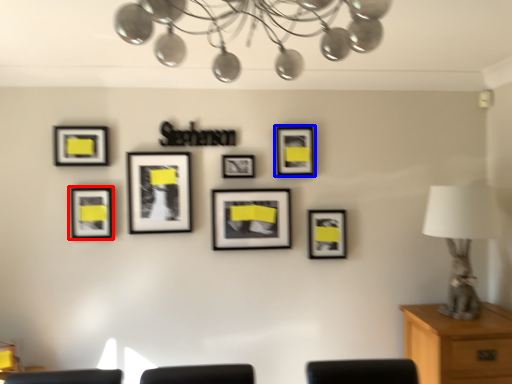
Question: Which object appears closest to the camera in this image, picture frame (highlighted by a red box) or picture frame (highlighted by a blue box)?

Choices:
 (A) picture frame
 (B) picture frame

Answer: (A)